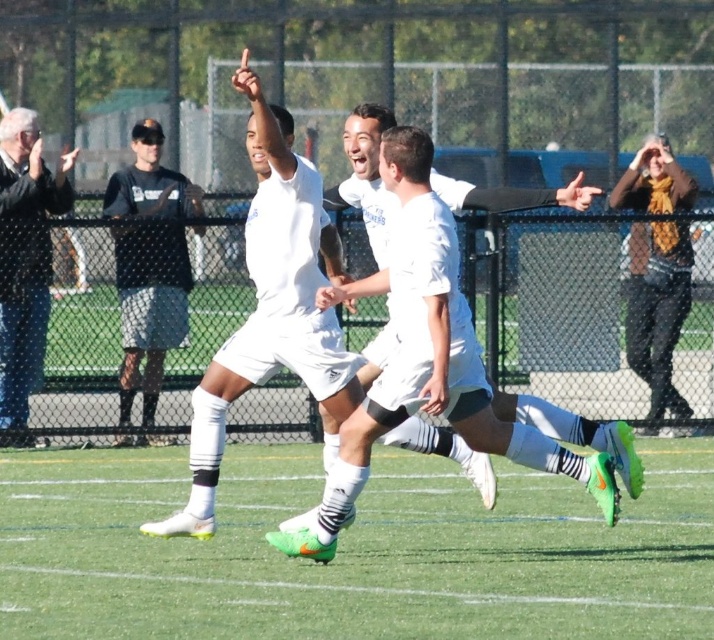
Does white matte soccer player at center appear over black mesh shirt at left?

Correct, white matte soccer player at center is located above black mesh shirt at left.

Can you confirm if white matte soccer player at center is wider than black mesh shirt at left?

Correct, the width of white matte soccer player at center exceeds that of black mesh shirt at left.

Identify the location of white matte soccer player at center. This screenshot has width=714, height=640. (268, 310).

Where is `black mesh shirt at left`? The width and height of the screenshot is (714, 640). black mesh shirt at left is located at coordinates (149, 308).

Who is more distant from viewer, (140,157) or (6,227)?

The point (140,157) is behind.

Describe the element at coordinates (149, 308) in the screenshot. I see `black mesh shirt at left` at that location.

At what (x,y) coordinates should I click in order to perform the action: click on black mesh shirt at left. Please return your answer as a coordinate pair (x, y). Looking at the image, I should click on (149, 308).

Consider the image. Can you confirm if white matte soccer player at center is wider than blue jeans at left?

Yes, white matte soccer player at center is wider than blue jeans at left.

Find the location of `white matte soccer player at center`. white matte soccer player at center is located at coordinates (268, 310).